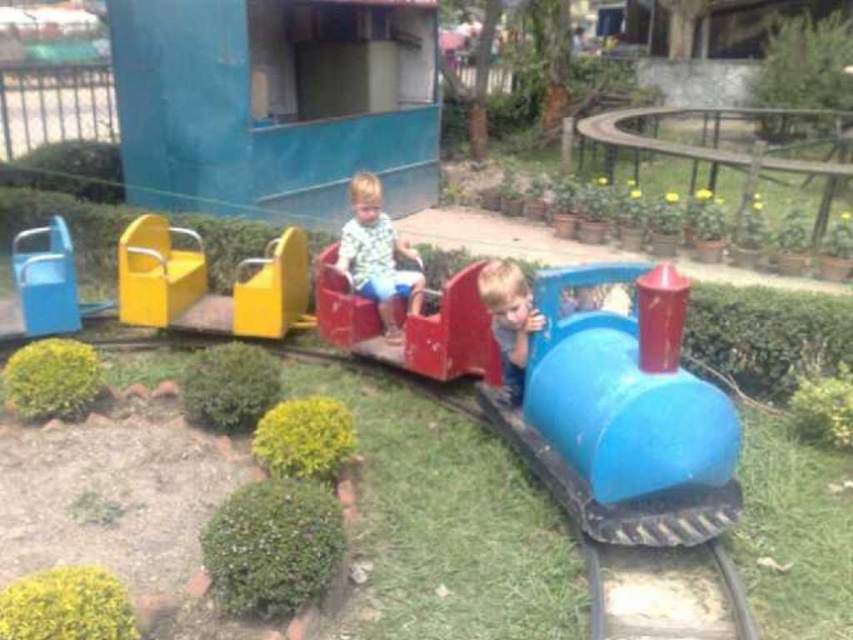
Does blue plastic train at center appear on the left side of matte green shirt at center?

No, blue plastic train at center is not to the left of matte green shirt at center.

Is blue plastic train at center below matte green shirt at center?

Yes.

Describe the element at coordinates (624, 413) in the screenshot. I see `blue plastic train at center` at that location.

Locate an element on the screen. Image resolution: width=853 pixels, height=640 pixels. blue plastic train at center is located at coordinates (624, 413).

Based on the photo, is blue plastic train at center behind metallic yellow seat at left?

No, it is in front of metallic yellow seat at left.

Does blue plastic train at center appear on the right side of metallic yellow seat at left?

Yes, blue plastic train at center is to the right of metallic yellow seat at left.

You are a GUI agent. You are given a task and a screenshot of the screen. Output one action in this format:
    pyautogui.click(x=<x>, y=<y>)
    Task: Click on the blue plastic train at center
    
    Given the screenshot: What is the action you would take?
    pyautogui.click(x=624, y=413)

Between metallic yellow seat at left and smooth blue train at center, which one is positioned lower?

smooth blue train at center

Is point (128, 294) closer to viewer compared to point (509, 346)?

No, it is not.

At what (x,y) coordinates should I click in order to perform the action: click on metallic yellow seat at left. Please return your answer as a coordinate pair (x, y). The height and width of the screenshot is (640, 853). Looking at the image, I should click on (155, 272).